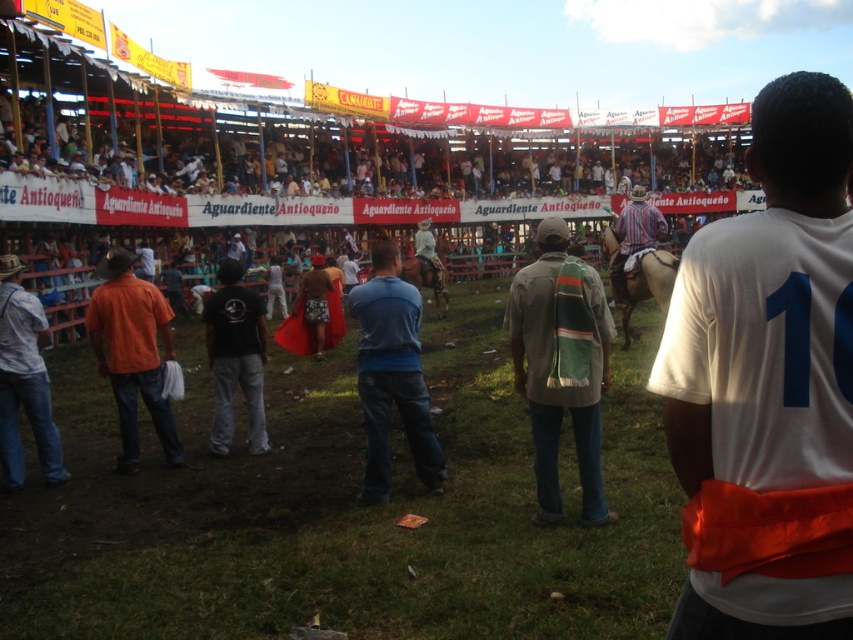
Is point (386, 486) positioned in front of point (27, 336)?

Yes, it is in front of point (27, 336).

Between point (370, 449) and point (47, 408), which one is positioned behind?

The point (47, 408) is more distant.

Where is `blue jeans at center`? The width and height of the screenshot is (853, 640). blue jeans at center is located at coordinates (392, 376).

This screenshot has width=853, height=640. I want to click on blue jeans at center, so click(392, 376).

Which is behind, point (747, 300) or point (628, 227)?

The point (628, 227) is behind.

Is point (755, 122) closer to viewer compared to point (637, 205)?

Yes, it is in front of point (637, 205).

What are the coordinates of `white jersey at center` in the screenshot? It's located at (769, 385).

Is white jersey at center smaller than black cotton t-shirt at center?

Indeed, white jersey at center has a smaller size compared to black cotton t-shirt at center.

Is white jersey at center to the left of black cotton t-shirt at center from the viewer's perspective?

No, white jersey at center is not to the left of black cotton t-shirt at center.

Image resolution: width=853 pixels, height=640 pixels. I want to click on white jersey at center, so click(769, 385).